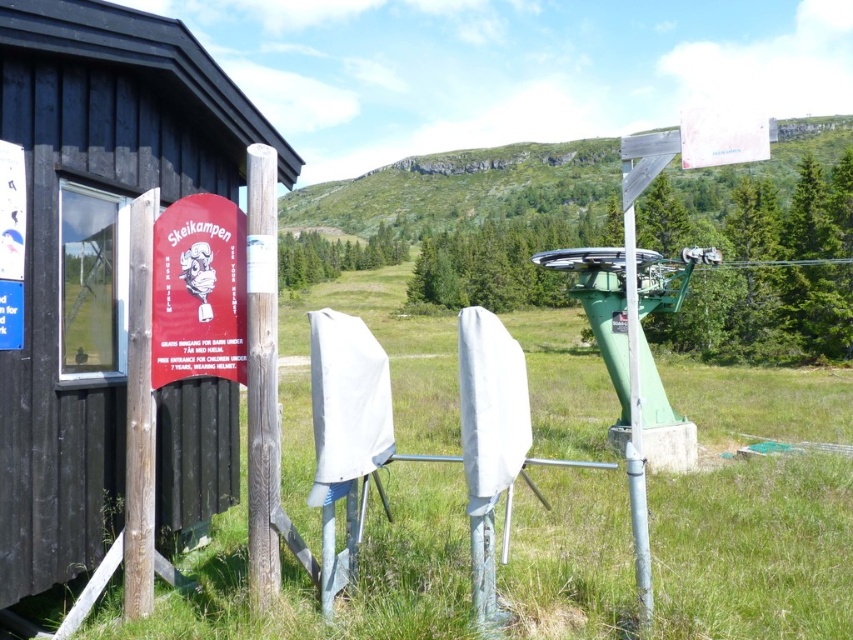
You are planning to set up a temporary tent between the black wood hut at left and the brown wooden pole at left. Considering their sizes, which object will require more space on the side where you want to place the tent?

The black wood hut at left has a larger width than the brown wooden pole at left, so it will require more space on the side where you want to place the tent.

You are standing at the entrance of the small wooden structure with dark vertical siding. Which direction should you walk to reach the brown wooden pole at left?

You should walk towards the left side of the entrance to reach the brown wooden pole at left, as it is located at point (138, 413) which is to the left relative to the entrance.